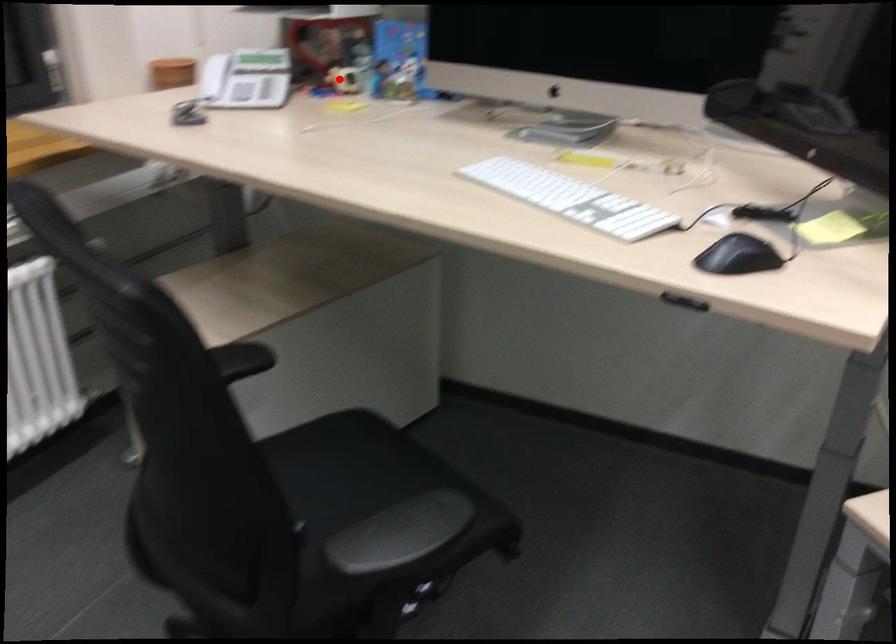
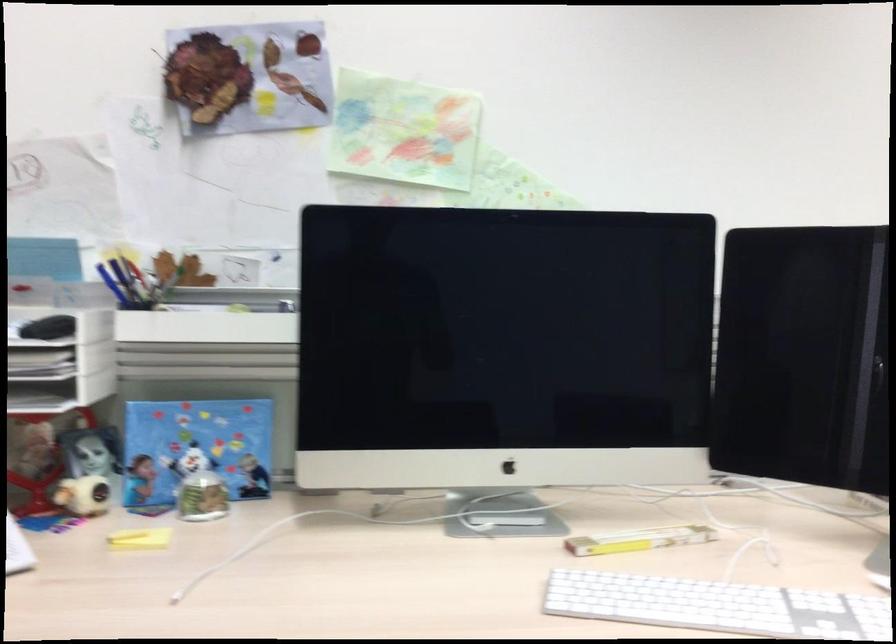
Question: I am providing you with two images of the same scene from different viewpoints. A red point is marked on the first image. Is the red point's position out of view in image 2?

Choices:
 (A) Yes
 (B) No

Answer: (B)